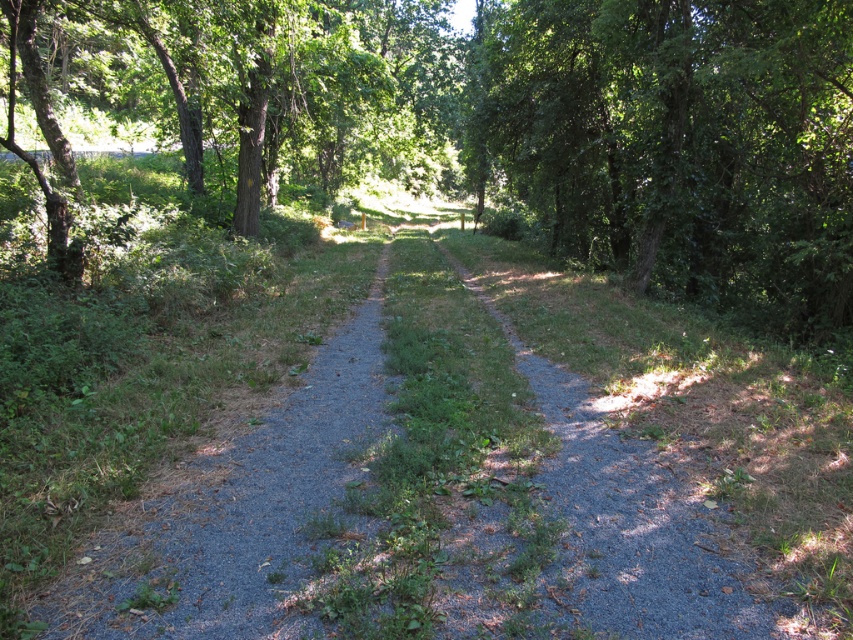
You are a hiker walking along the gray gravel path at center and want to reach the green leafy tree at center. Which direction should you move relative to the path to get there?

The green leafy tree at center is positioned on the left side of the gray gravel path at center, so you should move to the left side of the path to reach it.

You are a hiker standing on the gravel path in the forest. You see two points marked on the path. The first point is at coordinate (x=656, y=186), and the second point is at (x=843, y=74). Which point is closer to you?

Point (x=656, y=186) is further to the camera than point (x=843, y=74). Therefore, the point at (x=843, y=74) is closer to you.